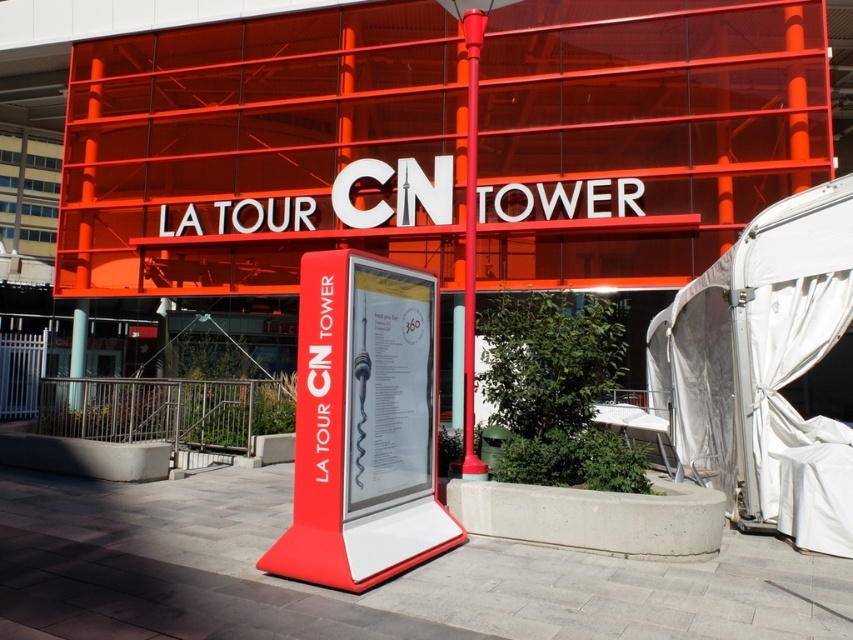
You are a visitor at the entrance of La Tour CN Tower and want to read the text on the matte red sign at center. However, you notice the white fabric tent at right is blocking your view. Can you move around the tent to see the sign clearly?

The matte red sign at center is behind the white fabric tent at right, so moving around the tent should allow you to see the sign clearly without obstruction.

You are standing at the entrance of La Tour CN Tower and see two points marked on the ground. The first point is at coordinate point (x=351, y=346) and the second is at point (x=477, y=92). If you want to walk towards the tower entrance, which point should you step on first?

Point (x=351, y=346) is in front of point (x=477, y=92), so you should step on point (x=351, y=346) first as it is closer to the tower entrance.